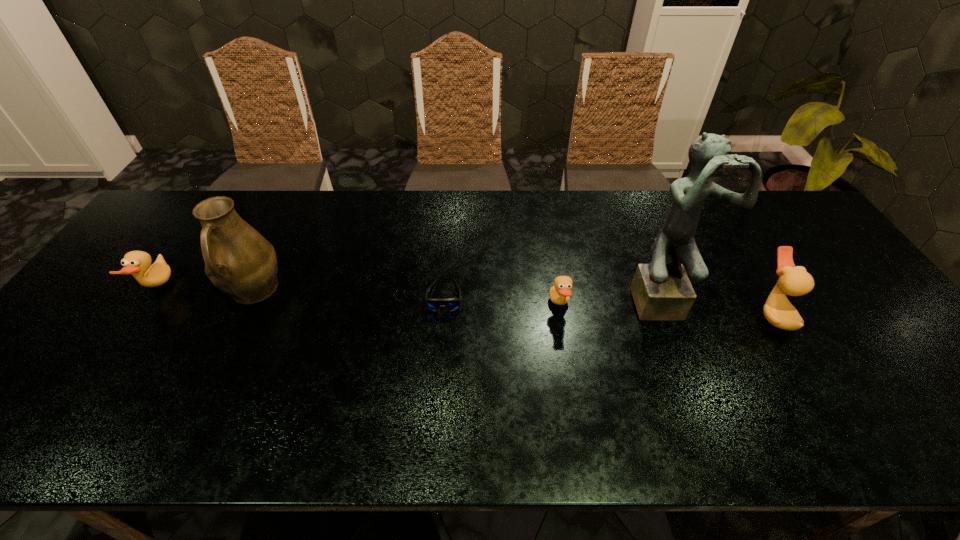
Identify the location of vacant area that lies between the second shortest object and the leftmost duck. (358, 296).

Find the location of a particular element. vacant region between the fifth object from right to left and the second shortest duck is located at coordinates (205, 289).

Find the location of a particular element. The width and height of the screenshot is (960, 540). free spot between the shortest object and the pitcher is located at coordinates (348, 293).

Identify the location of free space between the tallest object and the second duck from right to left. This screenshot has height=540, width=960. (610, 301).

Point out which object is positioned as the third nearest to the pitcher. Please provide its 2D coordinates. Your answer should be formatted as a tuple, i.e. [(x, y)], where the tuple contains the x and y coordinates of a point satisfying the conditions above.

[(560, 293)]

The image size is (960, 540). I want to click on object identified as the fifth closest to the fifth object from right to left, so click(794, 281).

Locate an element on the screen. duck that is the second nearest to the fifth object from left to right is located at coordinates (560, 293).

The image size is (960, 540). Find the location of `duck that stands as the third closest to the fifth object from right to left`. duck that stands as the third closest to the fifth object from right to left is located at coordinates (794, 281).